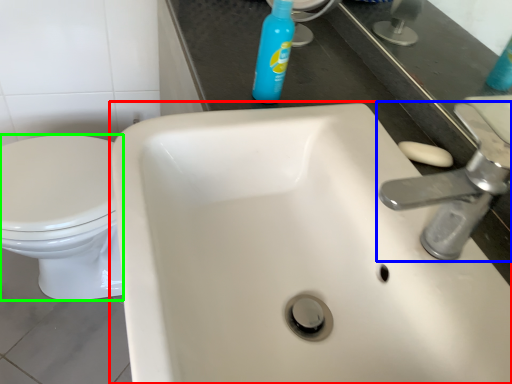
Question: Which object is the farthest from sink (highlighted by a red box)? Choose among these: tap (highlighted by a blue box) or bidet (highlighted by a green box).

Choices:
 (A) tap
 (B) bidet

Answer: (B)